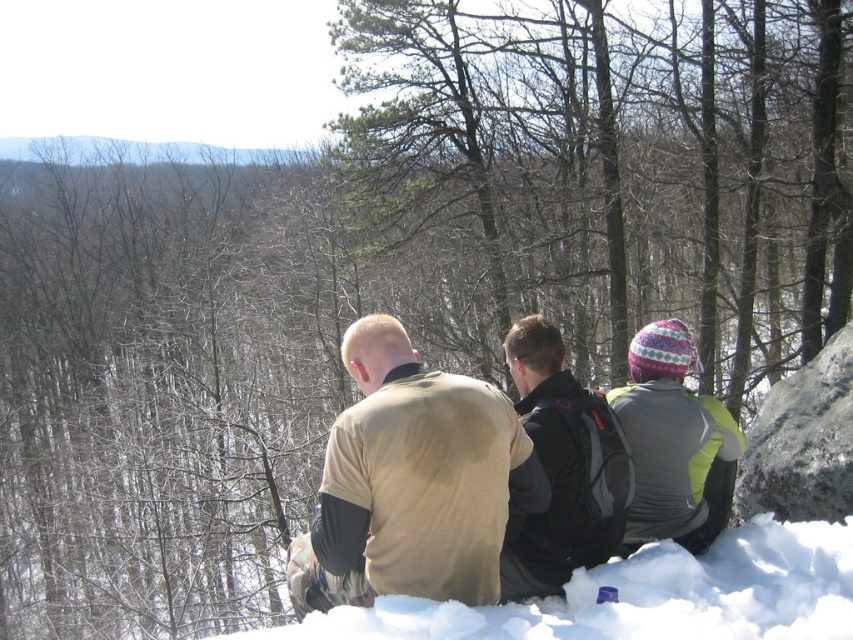
You are planning to take a photo of the smooth bark tree at center and the gray rough rock at right. Since you want both subjects to appear in the frame, which object should you focus on to ensure both are visible?

You should focus on the smooth bark tree at center because it is taller than the gray rough rock at right, so positioning the camera to include its full height will naturally include the shorter gray rough rock at right in the frame as well.

You are planning to build a snowman using the white fluffy snow at lower center. However, there is a gray rough rock at right nearby. Which object is closer to the ground and why?

The white fluffy snow at lower center is closer to the ground because it is positioned under the gray rough rock at right.

You are standing at the point marked as point (643, 596) in the image, which is white fluffy snow at lower center. You want to walk towards the dense forest in the background. Which direction should you move to reach the forest?

The dense forest is in the background behind the snowy surface where the individuals are sitting. Since you are at the white fluffy snow at lower center, moving forward in the direction away from the camera would lead you towards the forest.